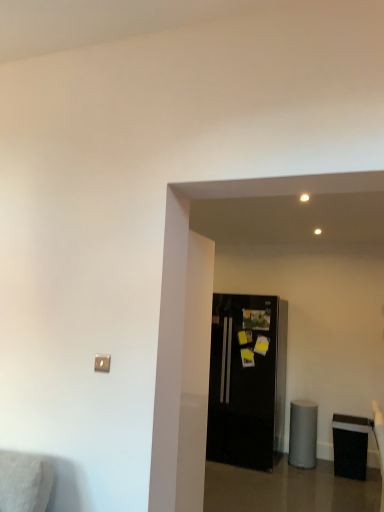
The height and width of the screenshot is (512, 384). What do you see at coordinates (247, 381) in the screenshot? I see `black glossy refrigerator at center` at bounding box center [247, 381].

You are a GUI agent. You are given a task and a screenshot of the screen. Output one action in this format:
    pyautogui.click(x=<x>, y=<y>)
    Task: Click on the black glossy refrigerator at center
    The width and height of the screenshot is (384, 512).
    Given the screenshot: What is the action you would take?
    pyautogui.click(x=247, y=381)

Locate an element on the screen. black matte trash can at lower right is located at coordinates (350, 445).

This screenshot has height=512, width=384. What do you see at coordinates (350, 445) in the screenshot?
I see `black matte trash can at lower right` at bounding box center [350, 445].

Find the location of `black glossy refrigerator at center`. black glossy refrigerator at center is located at coordinates (247, 381).

Considering the positions of objects black glossy refrigerator at center and black matte trash can at lower right in the image provided, who is more to the left, black glossy refrigerator at center or black matte trash can at lower right?

Positioned to the left is black glossy refrigerator at center.

Which object is closer to the camera taking this photo, black glossy refrigerator at center or black matte trash can at lower right?

Positioned in front is black matte trash can at lower right.

Is point (218, 367) in front of point (344, 418)?

That is False.

From the image's perspective, is black glossy refrigerator at center positioned above or below black matte trash can at lower right?

Clearly, from the image's perspective, black glossy refrigerator at center is above black matte trash can at lower right.

From the picture: From a real-world perspective, between black glossy refrigerator at center and black matte trash can at lower right, who is vertically higher?

black glossy refrigerator at center, from a real-world perspective.

Considering the relative sizes of black glossy refrigerator at center and black matte trash can at lower right in the image provided, is black glossy refrigerator at center thinner than black matte trash can at lower right?

No.

Which of these two, black glossy refrigerator at center or black matte trash can at lower right, stands taller?

black glossy refrigerator at center.

Considering the sizes of objects black glossy refrigerator at center and black matte trash can at lower right in the image provided, who is smaller, black glossy refrigerator at center or black matte trash can at lower right?

Smaller between the two is black matte trash can at lower right.

Is black glossy refrigerator at center positioned beyond the bounds of black matte trash can at lower right?

Yes, black glossy refrigerator at center is not within black matte trash can at lower right.

Looking at this image, is the surface of black glossy refrigerator at center in direct contact with black matte trash can at lower right?

black glossy refrigerator at center and black matte trash can at lower right are not in contact.

Could you tell me if black glossy refrigerator at center is turned towards black matte trash can at lower right?

No.

Locate an element on the screen. This screenshot has width=384, height=512. refrigerator above the black matte trash can at lower right (from the image's perspective) is located at coordinates 247,381.

Which object is positioned more to the left, black matte trash can at lower right or black glossy refrigerator at center?

Positioned to the left is black glossy refrigerator at center.

Relative to black glossy refrigerator at center, is black matte trash can at lower right in front or behind?

Clearly, black matte trash can at lower right is in front of black glossy refrigerator at center.

Is point (338, 424) positioned before point (265, 390)?

Yes, it is.

From the image's perspective, is black matte trash can at lower right under black glossy refrigerator at center?

Correct, black matte trash can at lower right appears lower than black glossy refrigerator at center in the image.

From a real-world perspective, is black matte trash can at lower right physically below black glossy refrigerator at center?

Yes, from a real-world perspective, black matte trash can at lower right is under black glossy refrigerator at center.

Considering the sizes of black matte trash can at lower right and black glossy refrigerator at center in the image, is black matte trash can at lower right wider or thinner than black glossy refrigerator at center?

Clearly, black matte trash can at lower right has less width compared to black glossy refrigerator at center.

Can you confirm if black matte trash can at lower right is shorter than black glossy refrigerator at center?

Indeed, black matte trash can at lower right has a lesser height compared to black glossy refrigerator at center.

Between black matte trash can at lower right and black glossy refrigerator at center, which one has smaller size?

Smaller between the two is black matte trash can at lower right.

Would you say black matte trash can at lower right contains black glossy refrigerator at center?

No, black glossy refrigerator at center is located outside of black matte trash can at lower right.

Can you see black matte trash can at lower right touching black glossy refrigerator at center?

No, black matte trash can at lower right is not in contact with black glossy refrigerator at center.

Is black matte trash can at lower right looking in the opposite direction of black glossy refrigerator at center?

No.

What's the angular difference between black matte trash can at lower right and black glossy refrigerator at center's facing directions?

2.2 degrees.

How much distance is there between black matte trash can at lower right and black glossy refrigerator at center?

The distance of black matte trash can at lower right from black glossy refrigerator at center is 96.52 centimeters.

Where is `refrigerator on the left of the black matte trash can at lower right`? The image size is (384, 512). refrigerator on the left of the black matte trash can at lower right is located at coordinates (247, 381).

Identify the location of refrigerator on the left of black matte trash can at lower right. (247, 381).

Locate an element on the screen. The height and width of the screenshot is (512, 384). furniture in front of the black glossy refrigerator at center is located at coordinates (350, 445).